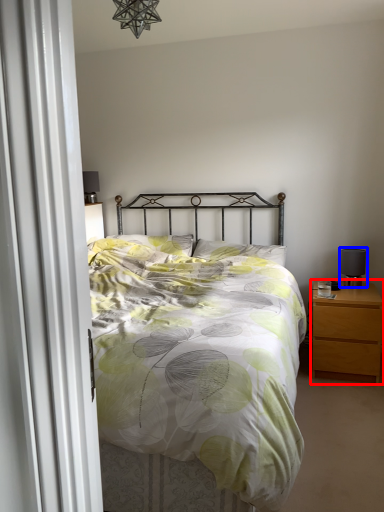
Question: Which object appears closest to the camera in this image, nightstand (highlighted by a red box) or table lamp (highlighted by a blue box)?

Choices:
 (A) nightstand
 (B) table lamp

Answer: (A)